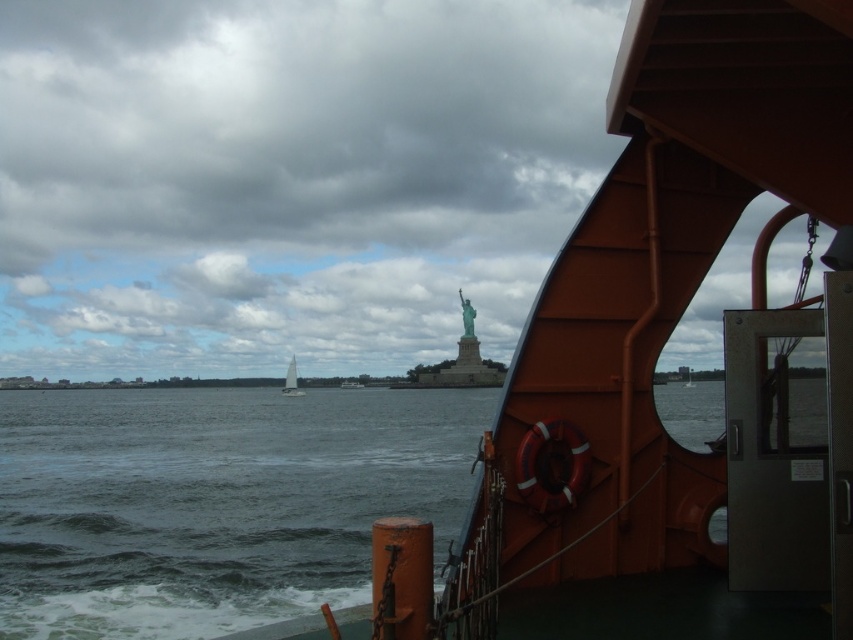
Who is more forward, [471,312] or [293,387]?

Point [471,312]

Can you confirm if green patina statue at center is wider than white sailboat at center?

In fact, green patina statue at center might be narrower than white sailboat at center.

Who is more distant from viewer, (467,317) or (287,376)?

Point (287,376)

You are a GUI agent. You are given a task and a screenshot of the screen. Output one action in this format:
    pyautogui.click(x=<x>, y=<y>)
    Task: Click on the green patina statue at center
    Image resolution: width=853 pixels, height=640 pixels.
    Given the screenshot: What is the action you would take?
    pyautogui.click(x=467, y=316)

Which is more to the left, dark gray water at center or white sailboat at center?

Positioned to the left is white sailboat at center.

Which is in front, point (322, 496) or point (294, 376)?

Point (322, 496) is in front.

The image size is (853, 640). I want to click on dark gray water at center, so (x=213, y=502).

Does point (397, 490) come in front of point (473, 328)?

Yes.

Does dark gray water at center have a smaller size compared to green patina statue at center?

Actually, dark gray water at center might be larger than green patina statue at center.

Identify the location of dark gray water at center. Image resolution: width=853 pixels, height=640 pixels. (213, 502).